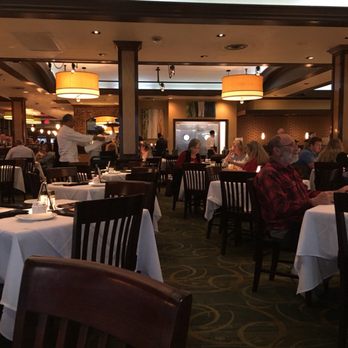
This screenshot has height=348, width=348. What are the coordinates of `carpet` in the screenshot? It's located at (196, 244).